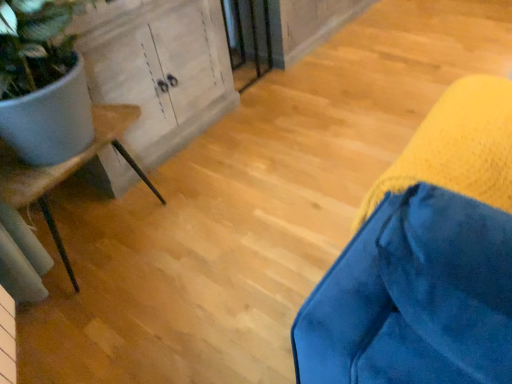
Where is `velvet blue cushion at lower right, which is the second furniture from left to right`? The height and width of the screenshot is (384, 512). velvet blue cushion at lower right, which is the second furniture from left to right is located at coordinates (425, 259).

What do you see at coordinates (159, 69) in the screenshot? This screenshot has width=512, height=384. I see `wooden cabinet at left` at bounding box center [159, 69].

This screenshot has height=384, width=512. Describe the element at coordinates (248, 40) in the screenshot. I see `wooden screen door at center` at that location.

Image resolution: width=512 pixels, height=384 pixels. I want to click on velvet blue cushion at lower right, the 2th furniture in the back-to-front sequence, so click(425, 259).

From the picture: How many degrees apart are the facing directions of velvet blue cushion at lower right, placed as the 1th furniture when sorted from front to back, and wooden screen door at center?

0.9 degrees separate the facing orientations of velvet blue cushion at lower right, placed as the 1th furniture when sorted from front to back, and wooden screen door at center.

Could you tell me if velvet blue cushion at lower right, placed as the 1th furniture when sorted from front to back, is turned towards wooden screen door at center?

No, velvet blue cushion at lower right, placed as the 1th furniture when sorted from front to back, does not turn towards wooden screen door at center.

From a real-world perspective, does velvet blue cushion at lower right, which is the second furniture from left to right, sit lower than wooden screen door at center?

No, from a real-world perspective, velvet blue cushion at lower right, which is the second furniture from left to right, is not under wooden screen door at center.

Which is in front, point (318, 302) or point (256, 12)?

The point (318, 302) is more forward.

Considering the sizes of wooden screen door at center and velvet blue cushion at lower right, placed as the 1th furniture when sorted from front to back, in the image, is wooden screen door at center bigger or smaller than velvet blue cushion at lower right, placed as the 1th furniture when sorted from front to back,?

Clearly, wooden screen door at center is larger in size than velvet blue cushion at lower right, placed as the 1th furniture when sorted from front to back.

Which is more to the right, wooden screen door at center or velvet blue cushion at lower right, which is the 1th furniture from right to left?

velvet blue cushion at lower right, which is the 1th furniture from right to left, is more to the right.

Does wooden screen door at center turn towards velvet blue cushion at lower right, which is the second furniture from left to right?

No, wooden screen door at center is not aimed at velvet blue cushion at lower right, which is the second furniture from left to right.

From a real-world perspective, which is physically below, wooden screen door at center or velvet blue cushion at lower right, which is the second furniture from left to right?

From a 3D spatial view, wooden screen door at center is below.

Would you say wooden screen door at center is to the left or to the right of wooden cabinet at left in the picture?

Based on their positions, wooden screen door at center is located to the right of wooden cabinet at left.

Is wooden screen door at center positioned with its back to wooden cabinet at left?

wooden screen door at center does not have its back to wooden cabinet at left.

From the image's perspective, which object appears higher, wooden screen door at center or wooden cabinet at left?

wooden screen door at center, from the image's perspective.

Considering the relative sizes of wooden screen door at center and wooden cabinet at left in the image provided, is wooden screen door at center bigger than wooden cabinet at left?

Incorrect, wooden screen door at center is not larger than wooden cabinet at left.

From the image's perspective, starting from the wooden cabinet at left, which furniture is the 1st one below? Please provide its 2D coordinates.

[(425, 259)]

How different are the orientations of velvet blue cushion at lower right, which is the second furniture from left to right, and wooden cabinet at left in degrees?

They differ by 0.512 degrees in their facing directions.

Considering the relative sizes of velvet blue cushion at lower right, placed as the 1th furniture when sorted from front to back, and wooden cabinet at left in the image provided, is velvet blue cushion at lower right, placed as the 1th furniture when sorted from front to back, shorter than wooden cabinet at left?

Indeed, velvet blue cushion at lower right, placed as the 1th furniture when sorted from front to back, has a lesser height compared to wooden cabinet at left.

How much distance is there between velvet blue cushion at lower right, which is the second furniture from left to right, and wooden cabinet at left?

velvet blue cushion at lower right, which is the second furniture from left to right, is 4.60 feet from wooden cabinet at left.

Consider the image. Is wooden cabinet at left placed right next to white matte plant pot at left, which is the second furniture from front to back?

No, wooden cabinet at left is not touching white matte plant pot at left, which is the second furniture from front to back.

From the image's perspective, which one is positioned higher, wooden cabinet at left or white matte plant pot at left, which is the second furniture from front to back?

wooden cabinet at left appears higher in the image.

In the image, is wooden cabinet at left positioned in front of or behind white matte plant pot at left, which is the second furniture from front to back?

Visually, wooden cabinet at left is located behind white matte plant pot at left, which is the second furniture from front to back.

Considering the sizes of objects wooden cabinet at left and white matte plant pot at left, the 2th furniture in the right-to-left sequence, in the image provided, who is smaller, wooden cabinet at left or white matte plant pot at left, the 2th furniture in the right-to-left sequence,?

With smaller size is white matte plant pot at left, the 2th furniture in the right-to-left sequence.

Is velvet blue cushion at lower right, which is the second furniture from left to right, behind white matte plant pot at left, the 1th furniture in the back-to-front sequence?

No, velvet blue cushion at lower right, which is the second furniture from left to right, is in front of white matte plant pot at left, the 1th furniture in the back-to-front sequence.

In the scene shown: Is velvet blue cushion at lower right, which is the 1th furniture from right to left, in contact with white matte plant pot at left, arranged as the 1th furniture when viewed from the left?

There is a gap between velvet blue cushion at lower right, which is the 1th furniture from right to left, and white matte plant pot at left, arranged as the 1th furniture when viewed from the left.

Would you say velvet blue cushion at lower right, placed as the 1th furniture when sorted from front to back, is outside white matte plant pot at left, which is the second furniture from front to back?

That's correct, velvet blue cushion at lower right, placed as the 1th furniture when sorted from front to back, is outside of white matte plant pot at left, which is the second furniture from front to back.

Is velvet blue cushion at lower right, the 2th furniture in the back-to-front sequence, wider than white matte plant pot at left, the 1th furniture in the back-to-front sequence?

No, velvet blue cushion at lower right, the 2th furniture in the back-to-front sequence, is not wider than white matte plant pot at left, the 1th furniture in the back-to-front sequence.

Which is less distant, (270, 38) or (155, 193)?

Point (270, 38) is farther from the camera than point (155, 193).

Is there a large distance between wooden screen door at center and white matte plant pot at left, which is the second furniture from front to back?

wooden screen door at center is far away from white matte plant pot at left, which is the second furniture from front to back.

From the image's perspective, is wooden screen door at center located beneath white matte plant pot at left, the 2th furniture in the right-to-left sequence?

Actually, wooden screen door at center appears above white matte plant pot at left, the 2th furniture in the right-to-left sequence, in the image.

At what (x,y) coordinates should I click in order to perform the action: click on screen door that is under the velvet blue cushion at lower right, which is the second furniture from left to right (from a real-world perspective). Please return your answer as a coordinate pair (x, y). Image resolution: width=512 pixels, height=384 pixels. Looking at the image, I should click on (248, 40).

Find the location of a particular element. The height and width of the screenshot is (384, 512). furniture on the right of wooden screen door at center is located at coordinates (425, 259).

Considering their positions, is velvet blue cushion at lower right, placed as the 1th furniture when sorted from front to back, positioned closer to wooden cabinet at left than white matte plant pot at left, which is the second furniture from front to back?

Based on the image, white matte plant pot at left, which is the second furniture from front to back, appears to be nearer to wooden cabinet at left.

Looking at the image, which one is located closer to white matte plant pot at left, arranged as the 1th furniture when viewed from the left, wooden cabinet at left or velvet blue cushion at lower right, which is the 1th furniture from right to left?

Based on the image, wooden cabinet at left appears to be nearer to white matte plant pot at left, arranged as the 1th furniture when viewed from the left.

Based on their spatial positions, is white matte plant pot at left, the 2th furniture in the right-to-left sequence, or wooden cabinet at left further from velvet blue cushion at lower right, placed as the 1th furniture when sorted from front to back?

wooden cabinet at left lies further to velvet blue cushion at lower right, placed as the 1th furniture when sorted from front to back, than the other object.

Estimate the real-world distances between objects in this image. Which object is further from white matte plant pot at left, the 1th furniture in the back-to-front sequence, wooden cabinet at left or wooden screen door at center?

wooden screen door at center lies further to white matte plant pot at left, the 1th furniture in the back-to-front sequence, than the other object.

Looking at the image, which one is located closer to white matte plant pot at left, the 2th furniture in the right-to-left sequence, velvet blue cushion at lower right, placed as the 1th furniture when sorted from front to back, or wooden cabinet at left?

wooden cabinet at left.

In the scene shown: Based on their spatial positions, is velvet blue cushion at lower right, placed as the 1th furniture when sorted from front to back, or wooden cabinet at left closer to wooden screen door at center?

wooden cabinet at left is positioned closer to the anchor wooden screen door at center.

When comparing their distances from white matte plant pot at left, which is the second furniture from front to back, does wooden screen door at center or velvet blue cushion at lower right, which is the 1th furniture from right to left, seem closer?

velvet blue cushion at lower right, which is the 1th furniture from right to left, lies closer to white matte plant pot at left, which is the second furniture from front to back, than the other object.

Looking at this image, when comparing their distances from wooden cabinet at left, does velvet blue cushion at lower right, which is the 1th furniture from right to left, or wooden screen door at center seem closer?

The object closer to wooden cabinet at left is wooden screen door at center.

Identify the location of furniture between velvet blue cushion at lower right, which is the second furniture from left to right, and wooden screen door at center, along the z-axis. (66, 169).

Locate an element on the screen. The width and height of the screenshot is (512, 384). cabinetry located between white matte plant pot at left, the 1th furniture in the back-to-front sequence, and wooden screen door at center in the depth direction is located at coordinates (159, 69).

The width and height of the screenshot is (512, 384). I want to click on cabinetry between white matte plant pot at left, the 2th furniture in the right-to-left sequence, and velvet blue cushion at lower right, which is the 1th furniture from right to left, so click(159, 69).

This screenshot has width=512, height=384. Find the location of `cabinetry between velvet blue cushion at lower right, which is the 1th furniture from right to left, and wooden screen door at center from front to back`. cabinetry between velvet blue cushion at lower right, which is the 1th furniture from right to left, and wooden screen door at center from front to back is located at coordinates (159, 69).